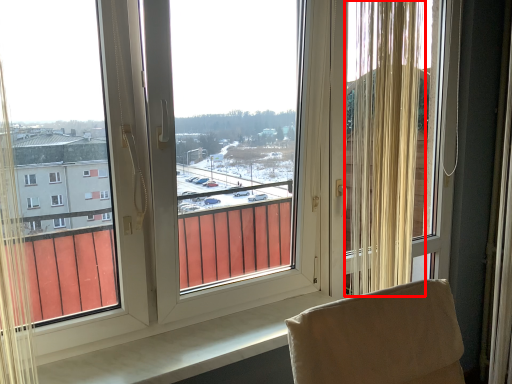
Question: Where is curtain (annotated by the red box) located in relation to window screen in the image?

Choices:
 (A) left
 (B) right

Answer: (B)